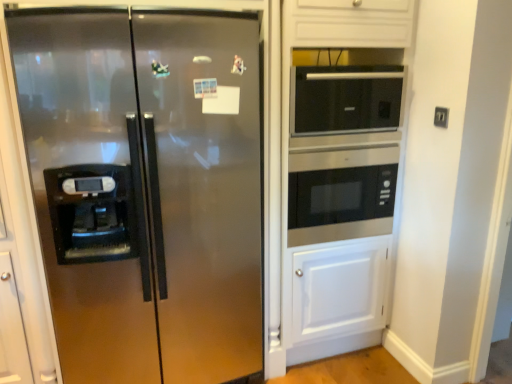
Question: Is black plastic electric outlet at upper right further to the viewer compared to black glass microwave at upper right, the first microwave oven positioned from the top?

Choices:
 (A) yes
 (B) no

Answer: (A)

Question: From a real-world perspective, is black plastic electric outlet at upper right under black glass microwave at upper right, the first microwave oven positioned from the top?

Choices:
 (A) no
 (B) yes

Answer: (B)

Question: Is black plastic electric outlet at upper right not close to black glass microwave at upper right, which appears as the 2th microwave oven when ordered from the bottom?

Choices:
 (A) yes
 (B) no

Answer: (B)

Question: Considering the relative sizes of black plastic electric outlet at upper right and black glass microwave at upper right, which appears as the 2th microwave oven when ordered from the bottom, in the image provided, is black plastic electric outlet at upper right wider than black glass microwave at upper right, which appears as the 2th microwave oven when ordered from the bottom,?

Choices:
 (A) no
 (B) yes

Answer: (A)

Question: Is black plastic electric outlet at upper right at the right side of black glass microwave at upper right, the first microwave oven positioned from the top?

Choices:
 (A) no
 (B) yes

Answer: (B)

Question: Is stainless steel microwave at center, which is the second microwave oven in top-to-bottom order, taller or shorter than black plastic electric outlet at upper right?

Choices:
 (A) tall
 (B) short

Answer: (A)

Question: Does point (310, 216) appear closer or farther from the camera than point (439, 125)?

Choices:
 (A) closer
 (B) farther

Answer: (B)

Question: Considering the positions of stainless steel microwave at center, which is the second microwave oven in top-to-bottom order, and black plastic electric outlet at upper right in the image, is stainless steel microwave at center, which is the second microwave oven in top-to-bottom order, bigger or smaller than black plastic electric outlet at upper right?

Choices:
 (A) small
 (B) big

Answer: (B)

Question: Is stainless steel microwave at center, the 1th microwave oven ordered from the bottom, wider or thinner than black plastic electric outlet at upper right?

Choices:
 (A) thin
 (B) wide

Answer: (B)

Question: From their relative heights in the image, would you say stainless steel refrigerator at left is taller or shorter than stainless steel microwave at center, which is the second microwave oven in top-to-bottom order?

Choices:
 (A) short
 (B) tall

Answer: (B)

Question: Relative to stainless steel microwave at center, which is the second microwave oven in top-to-bottom order, is stainless steel refrigerator at left in front or behind?

Choices:
 (A) front
 (B) behind

Answer: (A)

Question: Is stainless steel refrigerator at left wider or thinner than stainless steel microwave at center, which is the second microwave oven in top-to-bottom order?

Choices:
 (A) thin
 (B) wide

Answer: (B)

Question: Is stainless steel refrigerator at left to the left or to the right of stainless steel microwave at center, which is the second microwave oven in top-to-bottom order, in the image?

Choices:
 (A) left
 (B) right

Answer: (A)

Question: Is stainless steel refrigerator at left in front of or behind black plastic electric outlet at upper right in the image?

Choices:
 (A) behind
 (B) front

Answer: (B)

Question: Is stainless steel refrigerator at left to the left or to the right of black plastic electric outlet at upper right in the image?

Choices:
 (A) left
 (B) right

Answer: (A)